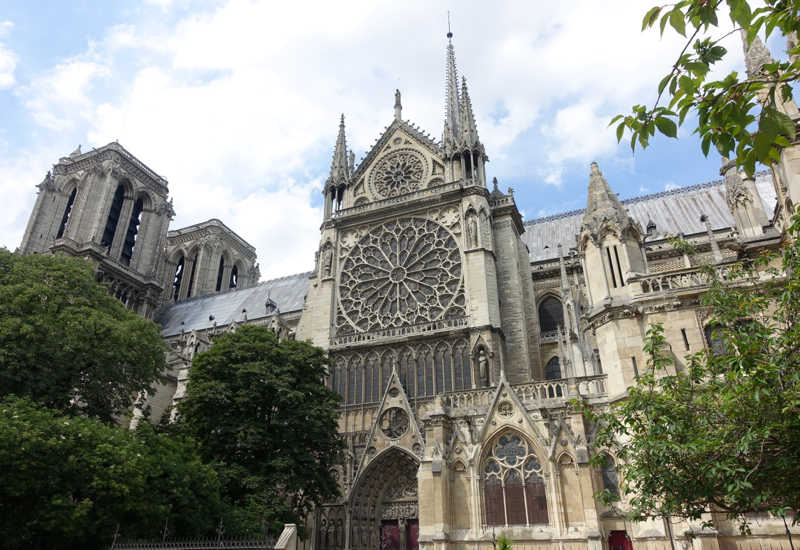
Locate an element on the screen. Image resolution: width=800 pixels, height=550 pixels. windows is located at coordinates (537, 507), (516, 509), (496, 510).